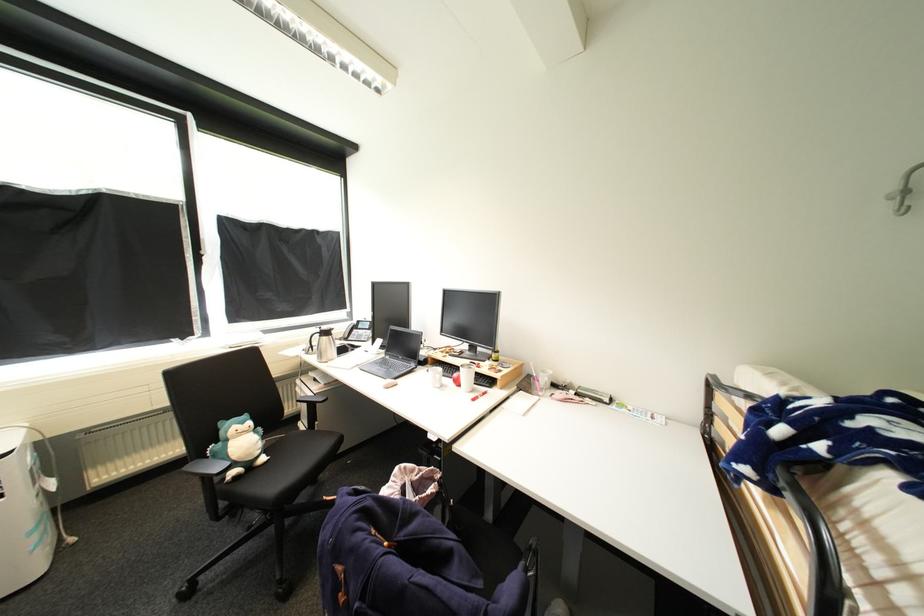
Describe the element at coordinates (285, 469) in the screenshot. I see `the black chair surface` at that location.